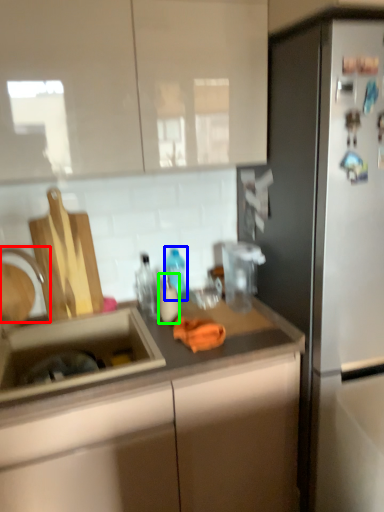
Question: Estimate the real-world distances between objects in this image. Which object is closer to faucet (highlighted by a red box), bottle (highlighted by a blue box) or bottle (highlighted by a green box)?

Choices:
 (A) bottle
 (B) bottle

Answer: (B)